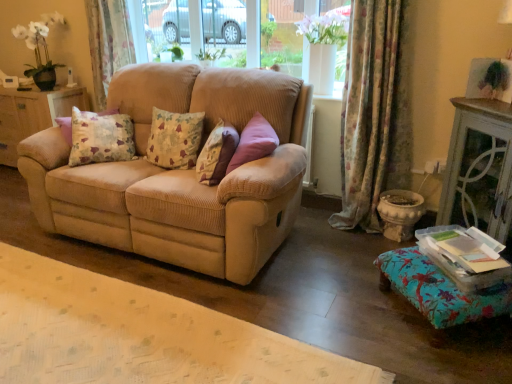
Question: Should I look upward or downward to see fluffy beige pillow at center, the 1th pillow when ordered from right to left?

Choices:
 (A) down
 (B) up

Answer: (B)

Question: Is fluffy beige pillow at center, marked as the 2th pillow in a left-to-right arrangement, at the right side of floral fabric curtain at upper left, arranged as the 2th curtain when viewed from the front?

Choices:
 (A) yes
 (B) no

Answer: (A)

Question: Can you confirm if fluffy beige pillow at center, marked as the 2th pillow in a left-to-right arrangement, is shorter than floral fabric curtain at upper left, the first curtain viewed from the back?

Choices:
 (A) no
 (B) yes

Answer: (B)

Question: Does fluffy beige pillow at center, the 1th pillow when ordered from right to left, have a lesser width compared to floral fabric curtain at upper left, arranged as the 2th curtain when viewed from the front?

Choices:
 (A) no
 (B) yes

Answer: (B)

Question: From a real-world perspective, does fluffy beige pillow at center, marked as the 2th pillow in a left-to-right arrangement, stand above floral fabric curtain at upper left, positioned as the 1th curtain in left-to-right order?

Choices:
 (A) no
 (B) yes

Answer: (A)

Question: Can you confirm if fluffy beige pillow at center, marked as the 2th pillow in a left-to-right arrangement, is taller than floral fabric curtain at upper left, arranged as the 2th curtain when viewed from the front?

Choices:
 (A) no
 (B) yes

Answer: (A)

Question: Is fluffy beige pillow at center, marked as the 2th pillow in a left-to-right arrangement, wider than floral fabric curtain at upper left, the first curtain viewed from the back?

Choices:
 (A) yes
 (B) no

Answer: (B)

Question: Is floral fabric ottoman at lower right surrounding clear glass window at center?

Choices:
 (A) no
 (B) yes

Answer: (A)

Question: Considering the relative sizes of floral fabric ottoman at lower right and clear glass window at center in the image provided, is floral fabric ottoman at lower right bigger than clear glass window at center?

Choices:
 (A) no
 (B) yes

Answer: (A)

Question: Is floral fabric ottoman at lower right beside clear glass window at center?

Choices:
 (A) yes
 (B) no

Answer: (B)

Question: Is floral fabric ottoman at lower right smaller than clear glass window at center?

Choices:
 (A) yes
 (B) no

Answer: (A)

Question: Is floral fabric ottoman at lower right not near clear glass window at center?

Choices:
 (A) no
 (B) yes

Answer: (B)

Question: From the image's perspective, is floral fabric ottoman at lower right above clear glass window at center?

Choices:
 (A) yes
 (B) no

Answer: (B)

Question: Is floral fabric curtain at upper left, positioned as the 1th curtain in left-to-right order, taller than floral fabric cushion at center, placed as the 2th pillow when sorted from right to left?

Choices:
 (A) no
 (B) yes

Answer: (B)